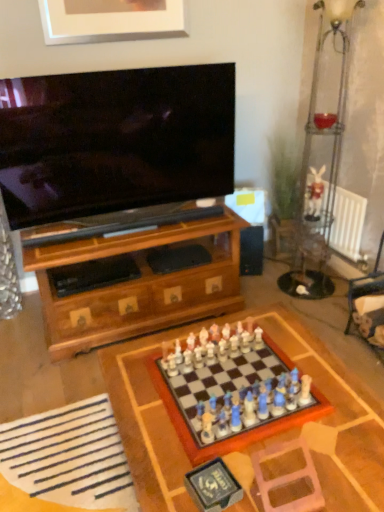
This screenshot has width=384, height=512. Find the location of `vacant region above wooden chess set at center (from a real-world perspective)`. vacant region above wooden chess set at center (from a real-world perspective) is located at coordinates (230, 382).